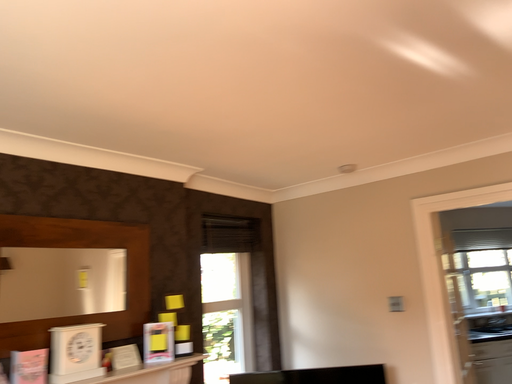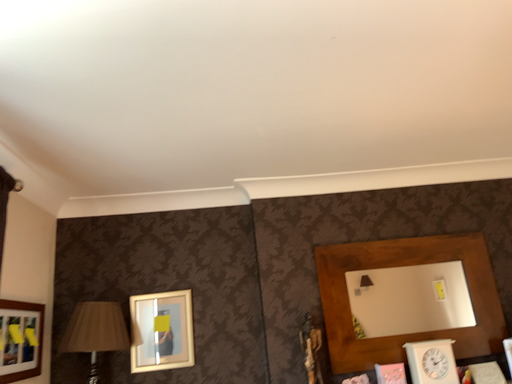
Question: How did the camera likely rotate when shooting the video?

Choices:
 (A) rotated left
 (B) rotated right

Answer: (A)